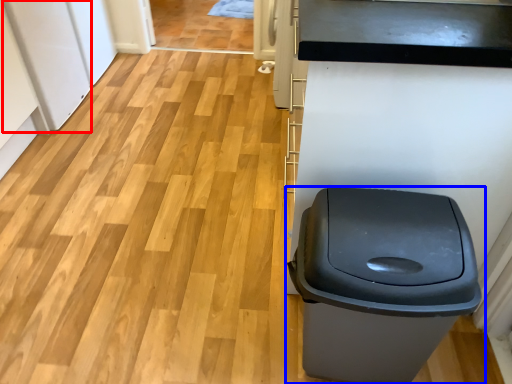
Question: Which of the following is the closest to the observer, appliance (highlighted by a red box) or waste container (highlighted by a blue box)?

Choices:
 (A) appliance
 (B) waste container

Answer: (B)